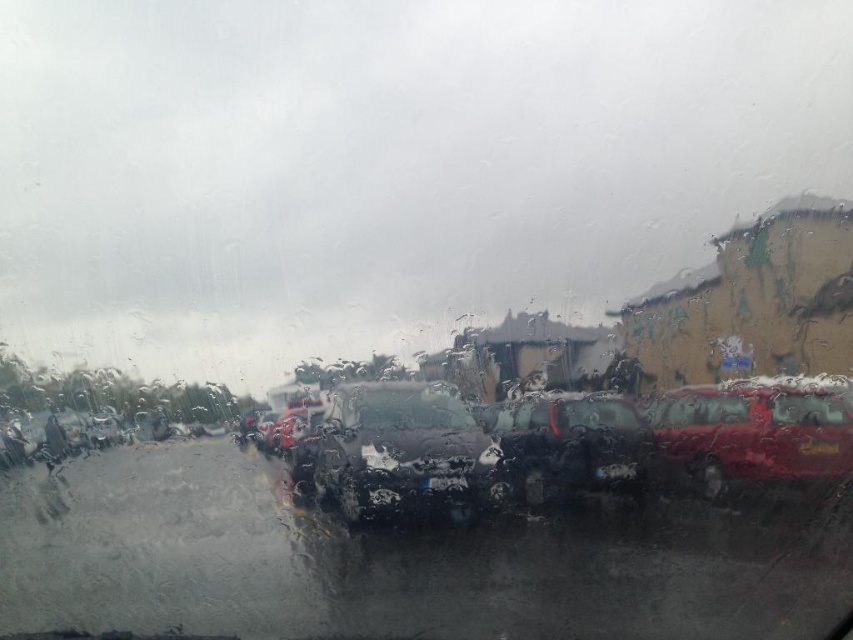
Consider the image. You are a passenger in a car and notice the glossy metallic car at right and the black plastic license plate at lower right through the rain streaked windshield. Which object is closer to you?

The glossy metallic car at right is closer to you because it is in front of the black plastic license plate at lower right.

You are a delivery driver trying to read the license plate number of the glossy metallic car at right from your current position. The black plastic license plate at lower right is partially obscured by raindrops. Can you reach the license plate without moving your vehicle?

The glossy metallic car at right is 8.96 inches away from the black plastic license plate at lower right. Since the distance is less than an arm length, you can reach the license plate without moving your vehicle.